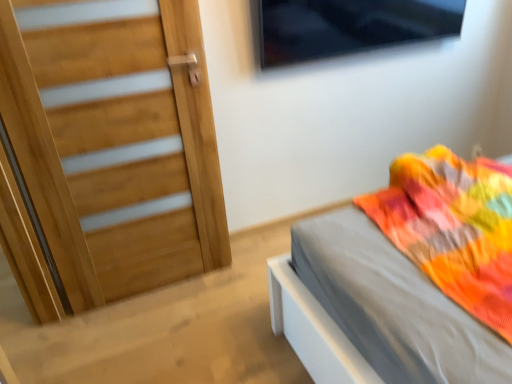
Locate an element on the screen. This screenshot has height=384, width=512. free space in front of natural wood door at left is located at coordinates (155, 350).